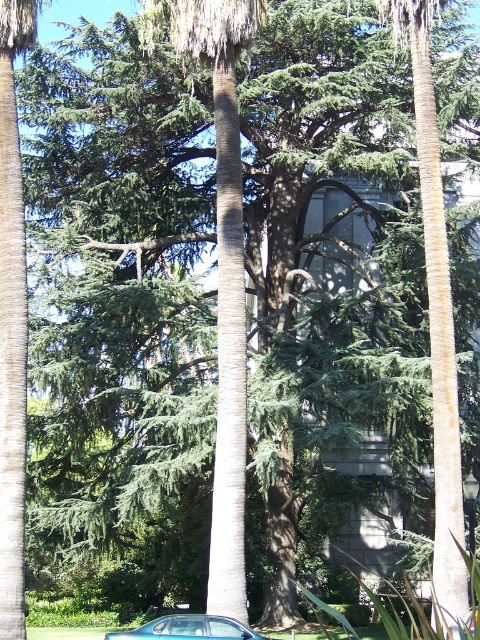
You are standing in the middle of a lush green area with tall trees. There is a car parked near the edge of the scene. A point labeled at coordinates (435,316) is marked. Which object does this point most likely correspond to?

The point labeled at coordinates (435,316) most likely corresponds to the smooth brown palm tree at center, as the Objects Description states that this point indicates that specific tree.

You are standing in the lush green area and want to take a photo of both the point at coordinates point (x=458, y=492) and point (x=240, y=632). Which point is closer to your camera when taking the photo?

Point (x=240, y=632) is closer to the camera than point (x=458, y=492) because the description states that point (x=458, y=492) is further away from the camera.

Looking at this image, you are a delivery person trying to park your metallic silver car at lower center near the smooth brown palm tree at center. Can you park the car directly under the tree without any obstruction?

The smooth brown palm tree at center is located above the metallic silver car at lower center, so yes, you can park the metallic silver car at lower center directly under the tree without any obstruction.